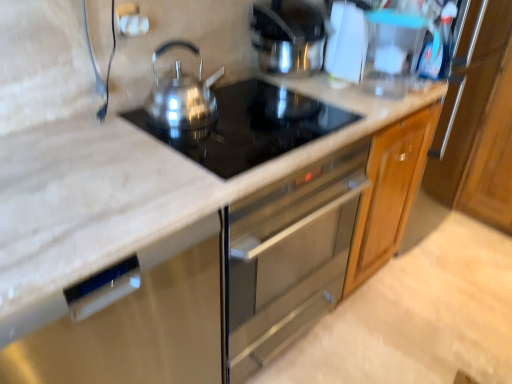
You are a GUI agent. You are given a task and a screenshot of the screen. Output one action in this format:
    pyautogui.click(x=<x>, y=<y>)
    Task: Click on the vacant area situated to the left side of transparent plastic pitcher at upper right
    Image resolution: width=512 pixels, height=384 pixels.
    Given the screenshot: What is the action you would take?
    pyautogui.click(x=342, y=95)